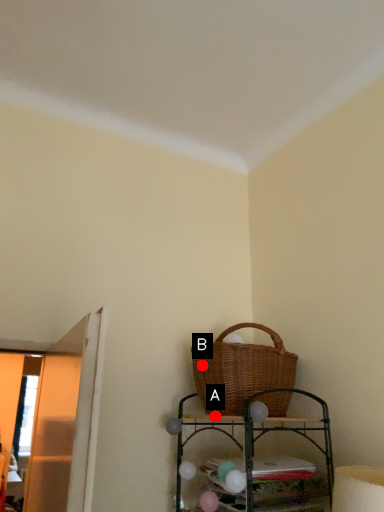
Question: Two points are circled on the image, labeled by A and B beside each circle. Which point is closer to the camera?

Choices:
 (A) A is closer
 (B) B is closer

Answer: (A)